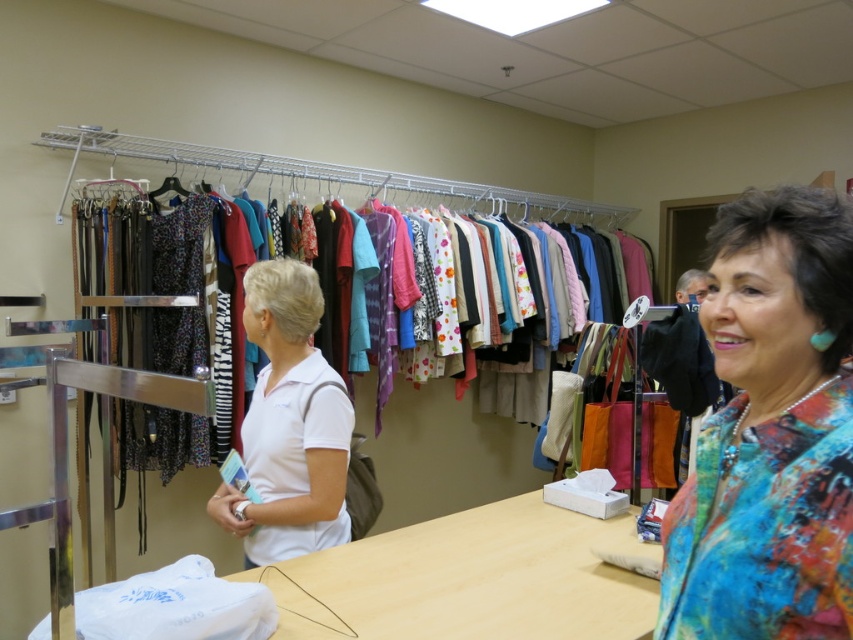
Is textured multicolored jacket at center bigger than white matte polo shirt at center?

Yes, textured multicolored jacket at center is bigger than white matte polo shirt at center.

Who is shorter, textured multicolored jacket at center or white matte polo shirt at center?

white matte polo shirt at center

Find the location of a particular element. Image resolution: width=853 pixels, height=640 pixels. textured multicolored jacket at center is located at coordinates (770, 432).

Does textured multicolored jacket at center have a greater height compared to matte fabric clothes at center?

No, textured multicolored jacket at center is not taller than matte fabric clothes at center.

Is textured multicolored jacket at center above matte fabric clothes at center?

No.

Where is `textured multicolored jacket at center`? This screenshot has height=640, width=853. textured multicolored jacket at center is located at coordinates (770, 432).

The width and height of the screenshot is (853, 640). Find the location of `textured multicolored jacket at center`. textured multicolored jacket at center is located at coordinates (770, 432).

Does textured multicolored jacket at center have a lesser height compared to wooden table at center?

No, textured multicolored jacket at center is not shorter than wooden table at center.

Is point (807, 596) positioned behind point (477, 612)?

No, (807, 596) is closer to viewer.

This screenshot has width=853, height=640. What do you see at coordinates (770, 432) in the screenshot?
I see `textured multicolored jacket at center` at bounding box center [770, 432].

I want to click on textured multicolored jacket at center, so click(770, 432).